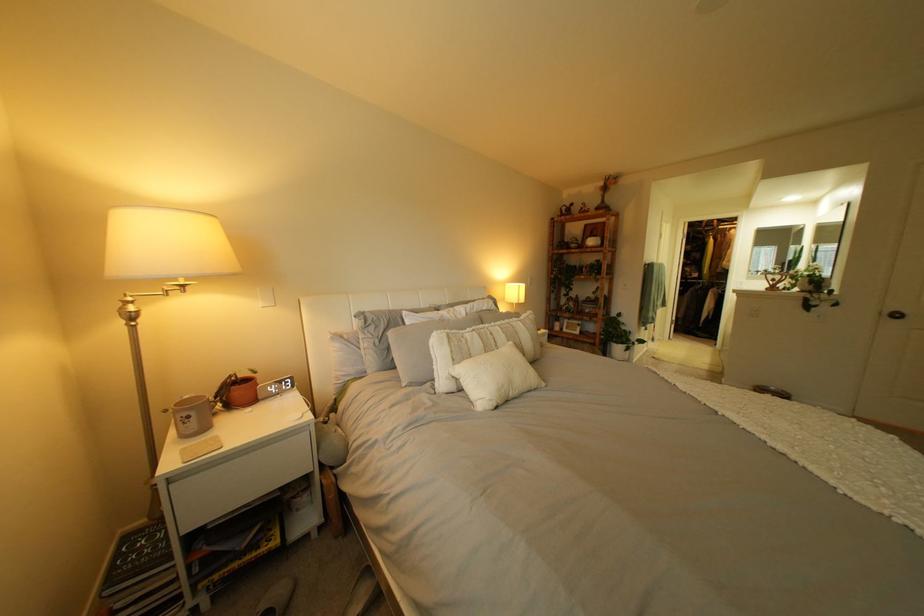
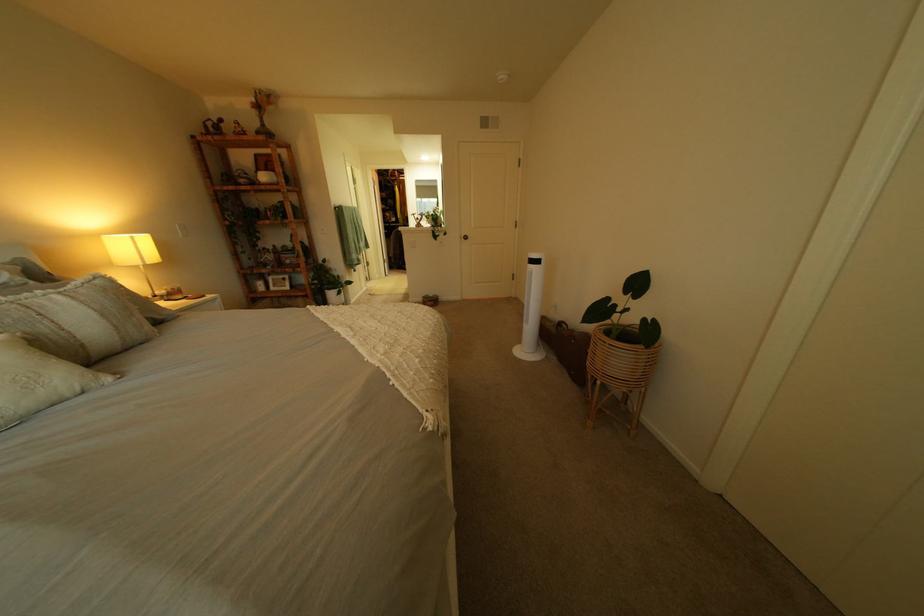
Question: The camera is either moving clockwise (left) or counter-clockwise (right) around the object. The first image is from the beginning of the video and the second image is from the end. Is the camera moving left or right when shooting the video?

Choices:
 (A) Left
 (B) Right

Answer: (A)